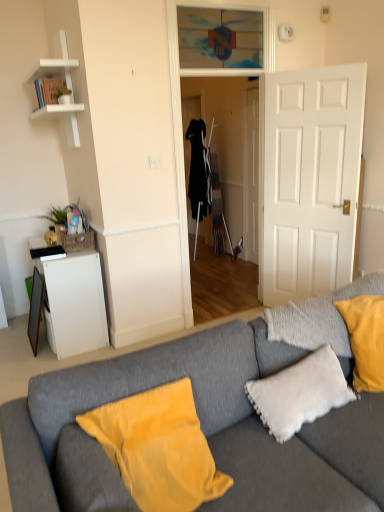
The height and width of the screenshot is (512, 384). Describe the element at coordinates (64, 95) in the screenshot. I see `green leafy plant at upper left` at that location.

Find the location of `white fluffy pillow at lower right, acting as the second pillow starting from the left`. white fluffy pillow at lower right, acting as the second pillow starting from the left is located at coordinates (300, 393).

What do you see at coordinates (311, 180) in the screenshot?
I see `white matte door at center` at bounding box center [311, 180].

At what (x,y) coordinates should I click in order to perform the action: click on velvet yellow pillow at lower center, placed as the second pillow when sorted from right to left. Please return your answer as a coordinate pair (x, y). The image size is (384, 512). Looking at the image, I should click on (158, 448).

Image resolution: width=384 pixels, height=512 pixels. In order to click on green leafy plant at upper left in this screenshot , I will do `click(64, 95)`.

How many degrees apart are the facing directions of white matte door at center and green leafy plant at upper left?

24.4 degrees.

Which is further, (294,280) or (63,100)?

The point (294,280) is farther.

Is white matte door at center at the left side of green leafy plant at upper left?

Incorrect, white matte door at center is not on the left side of green leafy plant at upper left.

Can you confirm if white fluffy pillow at lower right, acting as the 1th pillow starting from the right, is positioned to the left of gray fabric couch at center?

In fact, white fluffy pillow at lower right, acting as the 1th pillow starting from the right, is to the right of gray fabric couch at center.

Does white fluffy pillow at lower right, acting as the 1th pillow starting from the right, have a greater width compared to gray fabric couch at center?

Incorrect, the width of white fluffy pillow at lower right, acting as the 1th pillow starting from the right, does not surpass that of gray fabric couch at center.

Is gray fabric couch at center located within white fluffy pillow at lower right, acting as the 1th pillow starting from the right?

No, gray fabric couch at center is not inside white fluffy pillow at lower right, acting as the 1th pillow starting from the right.

Is gray fabric couch at center facing away from transparent glass door at upper center?

gray fabric couch at center does not have its back to transparent glass door at upper center.

Is gray fabric couch at center inside the boundaries of transparent glass door at upper center, or outside?

gray fabric couch at center lies outside transparent glass door at upper center.

Does gray fabric couch at center have a lesser width compared to transparent glass door at upper center?

Incorrect, the width of gray fabric couch at center is not less than that of transparent glass door at upper center.

Is there a large distance between white matte door at center and white fluffy pillow at lower right, acting as the 1th pillow starting from the right?

Yes.

From the image's perspective, is white matte door at center located above or below white fluffy pillow at lower right, acting as the second pillow starting from the left?

From the image's perspective, white matte door at center appears above white fluffy pillow at lower right, acting as the second pillow starting from the left.

Is white fluffy pillow at lower right, acting as the second pillow starting from the left, at the back of white matte door at center?

No, white matte door at center is not facing the opposite direction of white fluffy pillow at lower right, acting as the second pillow starting from the left.

From a real-world perspective, who is located lower, white matte door at center or white fluffy pillow at lower right, acting as the 1th pillow starting from the right?

From a 3D spatial view, white fluffy pillow at lower right, acting as the 1th pillow starting from the right, is below.

Does transparent glass door at upper center have a lesser width compared to gray fabric couch at center?

Yes, transparent glass door at upper center is thinner than gray fabric couch at center.

Based on the photo, between transparent glass door at upper center and gray fabric couch at center, which one has more height?

With more height is gray fabric couch at center.

Where is `studio couch below the transparent glass door at upper center (from a real-world perspective)`? The height and width of the screenshot is (512, 384). studio couch below the transparent glass door at upper center (from a real-world perspective) is located at coordinates (201, 428).

Is gray fabric couch at center at the back of transparent glass door at upper center?

That's not correct — transparent glass door at upper center is not looking away from gray fabric couch at center.

From the image's perspective, is transparent glass door at center over white fluffy pillow at lower right, acting as the second pillow starting from the left?

Correct, transparent glass door at center appears higher than white fluffy pillow at lower right, acting as the second pillow starting from the left, in the image.

Is transparent glass door at center next to white fluffy pillow at lower right, acting as the 1th pillow starting from the right, and touching it?

No, transparent glass door at center is not with white fluffy pillow at lower right, acting as the 1th pillow starting from the right.

Can you confirm if transparent glass door at center is shorter than white fluffy pillow at lower right, acting as the second pillow starting from the left?

In fact, transparent glass door at center may be taller than white fluffy pillow at lower right, acting as the second pillow starting from the left.

Measure the distance between white matte shelf at upper left and gray fabric couch at center.

white matte shelf at upper left and gray fabric couch at center are 7.71 feet apart.

Is white matte shelf at upper left oriented towards gray fabric couch at center?

No, white matte shelf at upper left is not aimed at gray fabric couch at center.

From a real-world perspective, who is located lower, white matte shelf at upper left or gray fabric couch at center?

In real-world perspective, gray fabric couch at center is lower.

Which is in front, white matte shelf at upper left or gray fabric couch at center?

gray fabric couch at center is more forward.

At what (x,y) coordinates should I click in order to perform the action: click on door that is in front of the green leafy plant at upper left. Please return your answer as a coordinate pair (x, y). Looking at the image, I should click on [x=311, y=180].

The height and width of the screenshot is (512, 384). There is a gray fabric couch at center. Find the location of `the 2nd pillow above it (from the image's perspective)`. the 2nd pillow above it (from the image's perspective) is located at coordinates (300, 393).

Which object lies nearer to the anchor point transparent glass door at center, white matte shelf at upper left or gray fabric couch at center?

white matte shelf at upper left.

Looking at the image, which one is located closer to white matte door at center, velvet yellow pillow at lower center, the first pillow positioned from the left, or transparent glass door at upper center?

transparent glass door at upper center is positioned closer to the anchor white matte door at center.

When comparing their distances from velvet yellow pillow at lower center, placed as the second pillow when sorted from right to left, does green leafy plant at upper left or transparent glass door at upper center seem closer?

The object closer to velvet yellow pillow at lower center, placed as the second pillow when sorted from right to left, is green leafy plant at upper left.

Looking at the image, which one is located closer to green leafy plant at upper left, transparent glass door at upper center or velvet yellow pillow at lower center, the first pillow positioned from the left?

transparent glass door at upper center.

When comparing their distances from white matte cabinet at left, does transparent glass door at upper center or white matte door at center seem closer?

Based on the image, white matte door at center appears to be nearer to white matte cabinet at left.

Looking at the image, which one is located further to white fluffy pillow at lower right, acting as the second pillow starting from the left, white matte door at center or transparent glass door at center?

The object further to white fluffy pillow at lower right, acting as the second pillow starting from the left, is transparent glass door at center.

Estimate the real-world distances between objects in this image. Which object is further from velvet yellow pillow at lower center, the first pillow positioned from the left, transparent glass door at center or white matte shelf at upper left?

transparent glass door at center is further to velvet yellow pillow at lower center, the first pillow positioned from the left.

Which object lies nearer to the anchor point white matte cabinet at left, green leafy plant at upper left or white matte shelf at upper left?

white matte shelf at upper left is closer to white matte cabinet at left.

The image size is (384, 512). Identify the location of houseplant between velvet yellow pillow at lower center, the first pillow positioned from the left, and white matte cabinet at left, along the z-axis. (64, 95).

Where is `glass door between white matte shelf at upper left and white matte door at center in the horizontal direction`? The height and width of the screenshot is (512, 384). glass door between white matte shelf at upper left and white matte door at center in the horizontal direction is located at coordinates (225, 135).

Where is `houseplant located between gray fabric couch at center and white matte cabinet at left in the depth direction`? Image resolution: width=384 pixels, height=512 pixels. houseplant located between gray fabric couch at center and white matte cabinet at left in the depth direction is located at coordinates (64, 95).

Locate an element on the screen. Image resolution: width=384 pixels, height=512 pixels. houseplant between transparent glass door at upper center and gray fabric couch at center vertically is located at coordinates (64, 95).